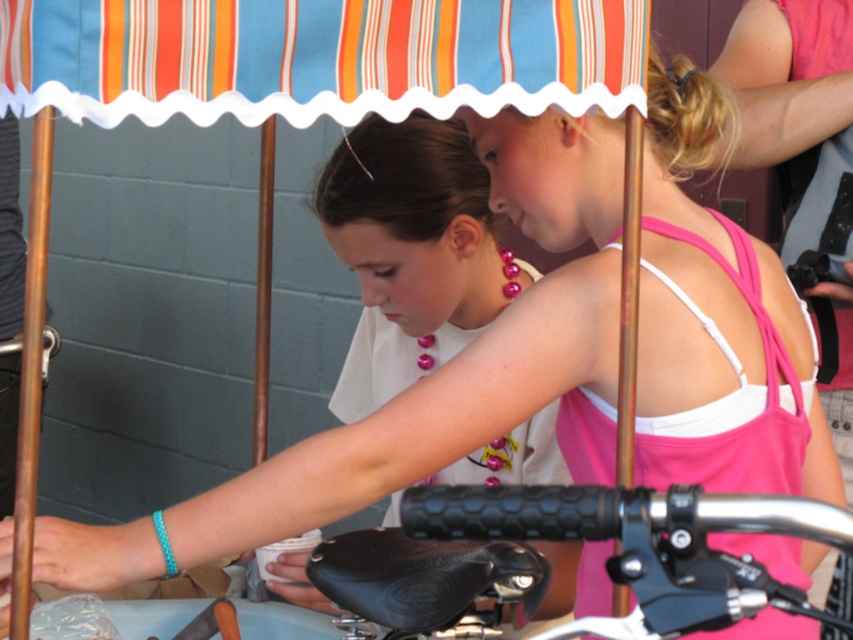
You are a photographer trying to capture a closeup shot of the pink pearl necklace at upper center and the black rubber handlebar at center. The camera you are using has a minimum focusing distance of 1 meter. Can you take a clear photo of both objects without moving the camera?

The pink pearl necklace at upper center is 1.08 meters away from the black rubber handlebar at center. Since the minimum focusing distance is 1 meter, the camera can focus on both objects as the distance between them is slightly more than the required minimum distance.

You are a photographer trying to capture the pink pearl necklace at upper center in the image. Based on its 2D coordinates, what is the best position to stand to ensure it is centered in your camera viewfinder?

The pink pearl necklace at upper center is located at coordinates (410,252). To center it in the camera viewfinder, the photographer should position themselves directly in line with these coordinates, ensuring the necklace is at the center point of the frame.

You are a jeweler who needs to decide whether to display the pink pearl necklace at upper center and the black rubber handlebar at center in the same showcase. Given that the showcase has a maximum height limit of 10 cm, can you determine if both items will fit vertically?

The pink pearl necklace at upper center is larger in size than the black rubber handlebar at center, but the exact dimensions are not provided. Without knowing their specific heights, it is impossible to confirm if they fit within the 10 cm height limit.